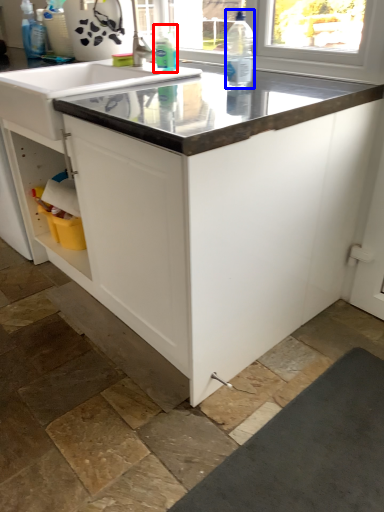
Question: Which of the following is the closest to the observer, cleaning product (highlighted by a red box) or bottle (highlighted by a blue box)?

Choices:
 (A) cleaning product
 (B) bottle

Answer: (B)